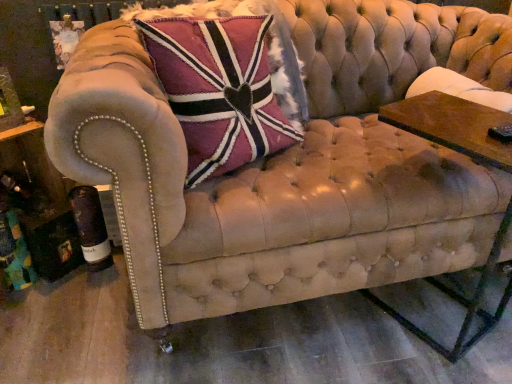
Question: From a real-world perspective, is wooden rectangular table at right positioned over velvet union jack pillow at upper left based on gravity?

Choices:
 (A) yes
 (B) no

Answer: (B)

Question: Can we say wooden rectangular table at right lies outside velvet union jack pillow at upper left?

Choices:
 (A) yes
 (B) no

Answer: (A)

Question: Is wooden rectangular table at right at the right side of velvet union jack pillow at upper left?

Choices:
 (A) no
 (B) yes

Answer: (B)

Question: Considering the relative positions of wooden rectangular table at right and velvet union jack pillow at upper left in the image provided, is wooden rectangular table at right to the left of velvet union jack pillow at upper left from the viewer's perspective?

Choices:
 (A) yes
 (B) no

Answer: (B)

Question: Is wooden rectangular table at right further to the viewer compared to velvet union jack pillow at upper left?

Choices:
 (A) yes
 (B) no

Answer: (B)

Question: Is wooden rectangular table at right positioned in front of velvet union jack pillow at upper left?

Choices:
 (A) yes
 (B) no

Answer: (A)

Question: From a real-world perspective, is velvet union jack pillow at upper left on wooden rectangular table at right?

Choices:
 (A) no
 (B) yes

Answer: (B)

Question: Does velvet union jack pillow at upper left appear on the left side of wooden rectangular table at right?

Choices:
 (A) yes
 (B) no

Answer: (A)

Question: Considering the relative sizes of velvet union jack pillow at upper left and wooden rectangular table at right in the image provided, is velvet union jack pillow at upper left taller than wooden rectangular table at right?

Choices:
 (A) yes
 (B) no

Answer: (B)

Question: From the image's perspective, would you say velvet union jack pillow at upper left is positioned over wooden rectangular table at right?

Choices:
 (A) no
 (B) yes

Answer: (B)

Question: Is velvet union jack pillow at upper left completely or partially outside of wooden rectangular table at right?

Choices:
 (A) no
 (B) yes

Answer: (B)

Question: Does velvet union jack pillow at upper left appear on the right side of wooden rectangular table at right?

Choices:
 (A) yes
 (B) no

Answer: (B)

Question: Does point (509, 221) appear closer or farther from the camera than point (248, 89)?

Choices:
 (A) farther
 (B) closer

Answer: (A)